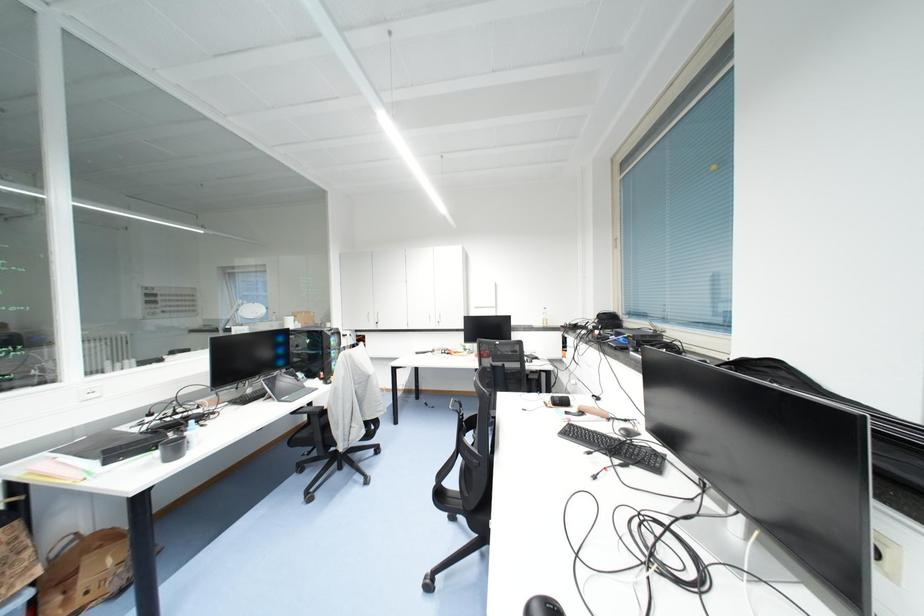
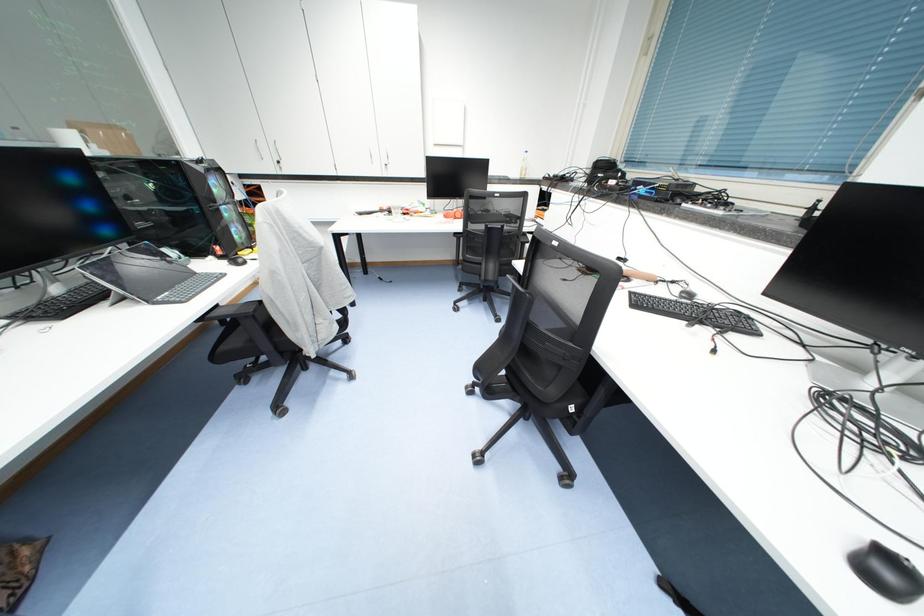
The first image is from the beginning of the video and the second image is from the end. How did the camera likely rotate when shooting the video?

The camera rotated toward right-down.